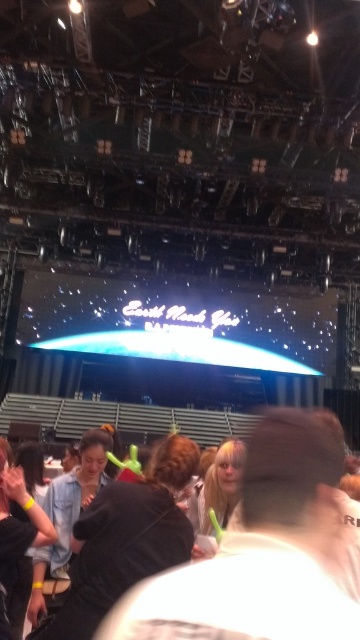
Question: Which point appears farthest from the camera in this image?

Choices:
 (A) (253, 435)
 (B) (54, 540)
 (C) (74, 593)

Answer: (B)

Question: Is black fabric at center thinner than black matte hair at lower left?

Choices:
 (A) yes
 (B) no

Answer: (B)

Question: Is black matte jacket at center to the right of black fabric at center from the viewer's perspective?

Choices:
 (A) yes
 (B) no

Answer: (A)

Question: From the image, what is the correct spatial relationship of black matte jacket at center in relation to black fabric at center?

Choices:
 (A) right
 (B) left

Answer: (A)

Question: Among these objects, which one is farthest from the camera?

Choices:
 (A) black fabric at center
 (B) black matte jacket at center
 (C) black matte hair at lower left

Answer: (C)

Question: Which of the following is the farthest from the observer?

Choices:
 (A) (2, 522)
 (B) (159, 556)

Answer: (A)